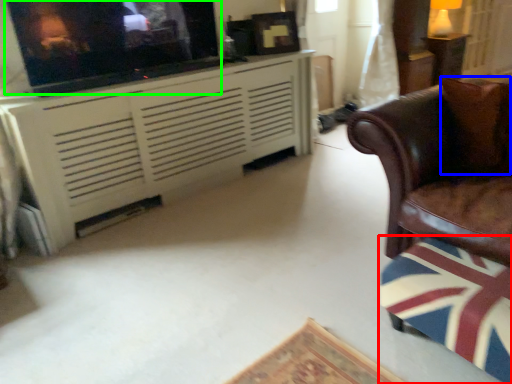
Question: Which object is the closest to the swivel chair (highlighted by a red box)? Choose among these: pillow (highlighted by a blue box) or tv show (highlighted by a green box).

Choices:
 (A) pillow
 (B) tv show

Answer: (A)